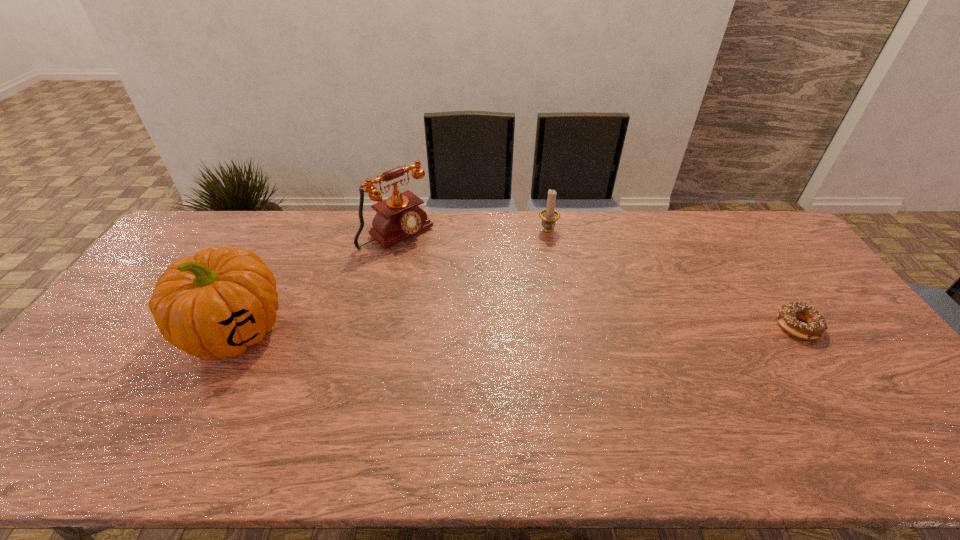
Identify the location of vacant space located on the dial of the third object from right to left. The width and height of the screenshot is (960, 540). (448, 273).

Find the location of a particular element. The height and width of the screenshot is (540, 960). free location located 0.350m on the handle side of the candle_holder is located at coordinates click(585, 314).

Where is `vacant space located on the handle side of the candle_holder`? vacant space located on the handle side of the candle_holder is located at coordinates (574, 290).

Locate an element on the screen. This screenshot has height=540, width=960. free space located 0.140m on the handle side of the candle_holder is located at coordinates (564, 266).

Locate an element on the screen. telephone at the far edge is located at coordinates (398, 217).

Identify the location of candle_holder that is at the far edge. The image size is (960, 540). (549, 216).

At what (x,y) coordinates should I click in order to perform the action: click on object located at the right edge. Please return your answer as a coordinate pair (x, y). Looking at the image, I should click on (815, 326).

Image resolution: width=960 pixels, height=540 pixels. I want to click on vacant space at the far edge of the desktop, so click(x=720, y=223).

The width and height of the screenshot is (960, 540). I want to click on vacant space at the near edge of the desktop, so click(255, 400).

This screenshot has width=960, height=540. I want to click on free space at the right edge of the desktop, so click(786, 289).